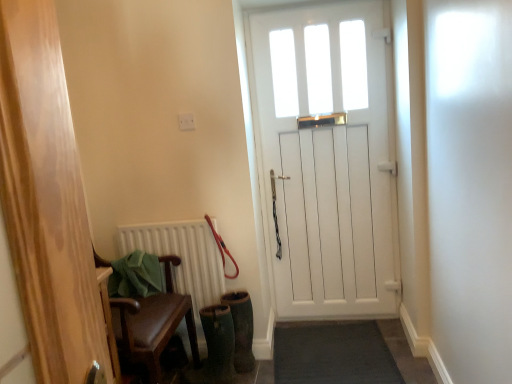
Question: Is red rubber leash at center bigger or smaller than green suede boot at lower center?

Choices:
 (A) small
 (B) big

Answer: (A)

Question: Visually, is red rubber leash at center positioned to the left or to the right of green suede boot at lower center?

Choices:
 (A) right
 (B) left

Answer: (B)

Question: Which object is the farthest from the white wooden door at center?

Choices:
 (A) dark gray carpet at lower center
 (B) green suede boot at lower center
 (C) red rubber leash at center
 (D) white matte radiator at lower left

Answer: (B)

Question: Which of these objects is positioned farthest from the green suede boot at lower center?

Choices:
 (A) red rubber leash at center
 (B) dark gray carpet at lower center
 (C) white wooden door at center
 (D) white matte radiator at lower left

Answer: (C)